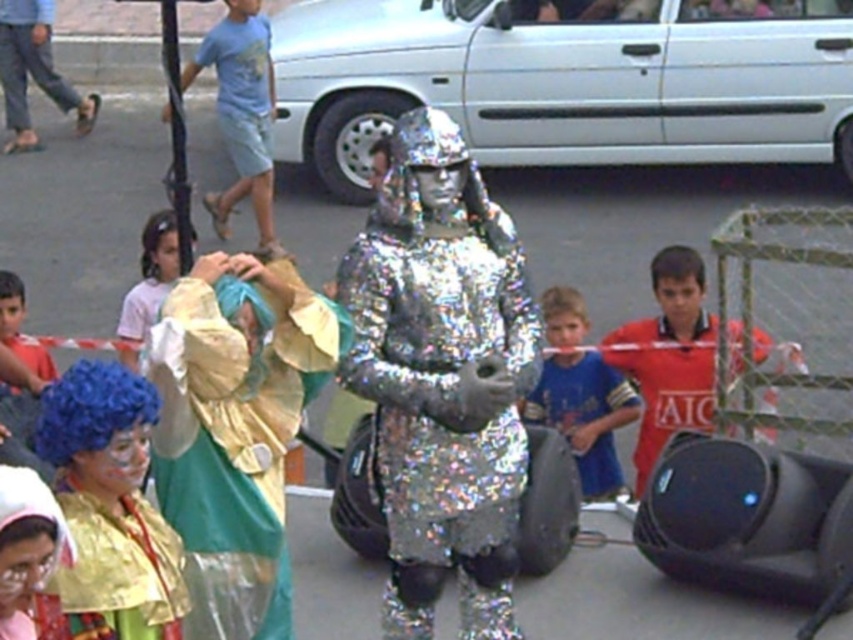
You are a photographer trying to capture the blue fabric shirt at center and the light pink fabric at upper left in the same frame. Based on their positions, which object should you focus on first to ensure both are in the shot?

The blue fabric shirt at center is located below the light pink fabric at upper left, so you should focus on the light pink fabric at upper left first to ensure both are in the frame.

You are a photographer trying to capture the holographic foil suit at center and the shiny gold costume at lower left in a single shot. Based on their positions, which costume will be in the background of the photo?

The holographic foil suit at center is positioned over the shiny gold costume at lower left, so the shiny gold costume at lower left will be in the background of the photo.

In the festive street scene, there is a person in a holographic foil suit at center and a child in matte blue jeans at left. Which of these two is taller?

The holographic foil suit at center is taller than the matte blue jeans at left according to the description.